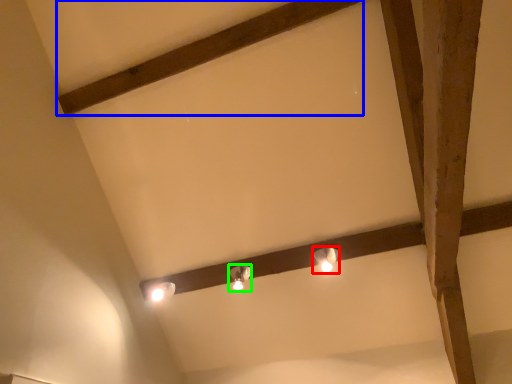
Question: Based on their relative distances, which object is nearer to lamp (highlighted by a red box)? Choose from plank (highlighted by a blue box) and lamp (highlighted by a green box).

Choices:
 (A) plank
 (B) lamp

Answer: (B)